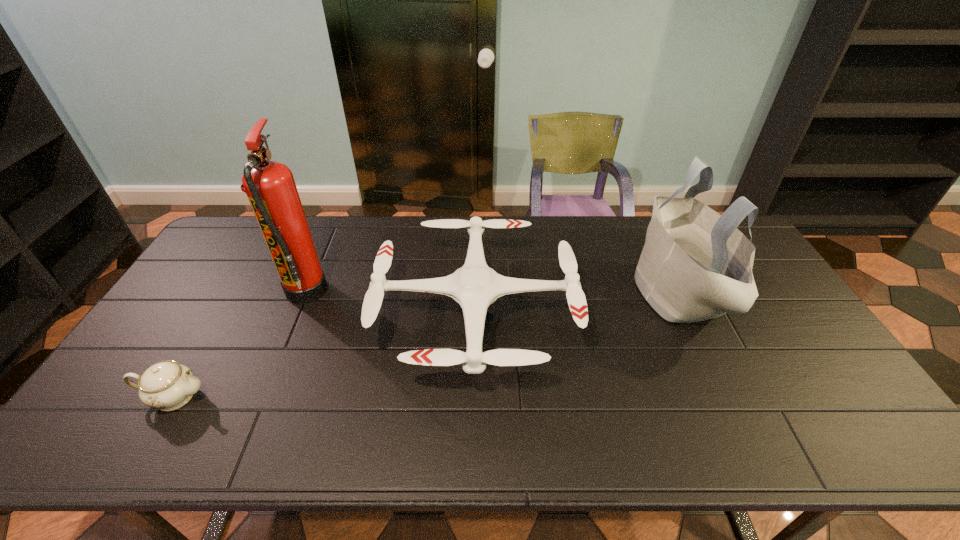
What are the coordinates of `vacant area at the near right corner` in the screenshot? It's located at (852, 448).

Image resolution: width=960 pixels, height=540 pixels. I want to click on blank region between the shortest object and the second object from left to right, so click(x=240, y=344).

Locate an element on the screen. vacant point located between the chinaware and the shopping bag is located at coordinates (427, 345).

Find the location of a particular element. vacant point located between the fire extinguisher and the second object from right to left is located at coordinates (391, 302).

Locate an element on the screen. This screenshot has height=540, width=960. vacant space that is in between the drone and the fire extinguisher is located at coordinates (391, 302).

You are a GUI agent. You are given a task and a screenshot of the screen. Output one action in this format:
    pyautogui.click(x=<x>, y=<y>)
    Task: Click on the free area in between the leftmost object and the second object from right to left
    The width and height of the screenshot is (960, 540).
    Given the screenshot: What is the action you would take?
    pyautogui.click(x=324, y=355)

At what (x,y) coordinates should I click in order to perform the action: click on vacant region between the second shortest object and the fire extinguisher. Please return your answer as a coordinate pair (x, y). The width and height of the screenshot is (960, 540). Looking at the image, I should click on (391, 302).

The height and width of the screenshot is (540, 960). In order to click on free space between the shortest object and the second tallest object in this screenshot , I will do `click(427, 345)`.

You are a GUI agent. You are given a task and a screenshot of the screen. Output one action in this format:
    pyautogui.click(x=<x>, y=<y>)
    Task: Click on the empty location between the third object from left to right and the fire extinguisher
    This screenshot has height=540, width=960.
    Given the screenshot: What is the action you would take?
    pyautogui.click(x=391, y=302)

Locate an element on the screen. free space between the shortest object and the fire extinguisher is located at coordinates (240, 344).